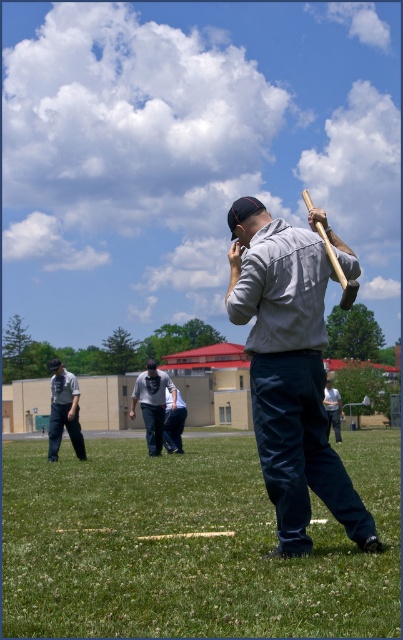
You are standing on the green grass at lower center and want to reach the matte gray shirt at center. Is the path directly in front of you clear of any obstacles?

The green grass at lower center is positioned under matte gray shirt at center, which means the matte gray shirt at center is directly above the green grass at lower center. Therefore, the path directly in front of you is blocked by the matte gray shirt at center.

You are standing at the point marked by the coordinates point (290, 372) in the image. Looking around, you see a matte gray shirt at center. Which direction should you walk to find the nearest player wearing a dark cap?

The nearest player wearing a dark cap is the man in the foreground holding a wooden bat over his shoulder, who is positioned behind you relative to your current location at point (290, 372). You should walk backward to reach him.